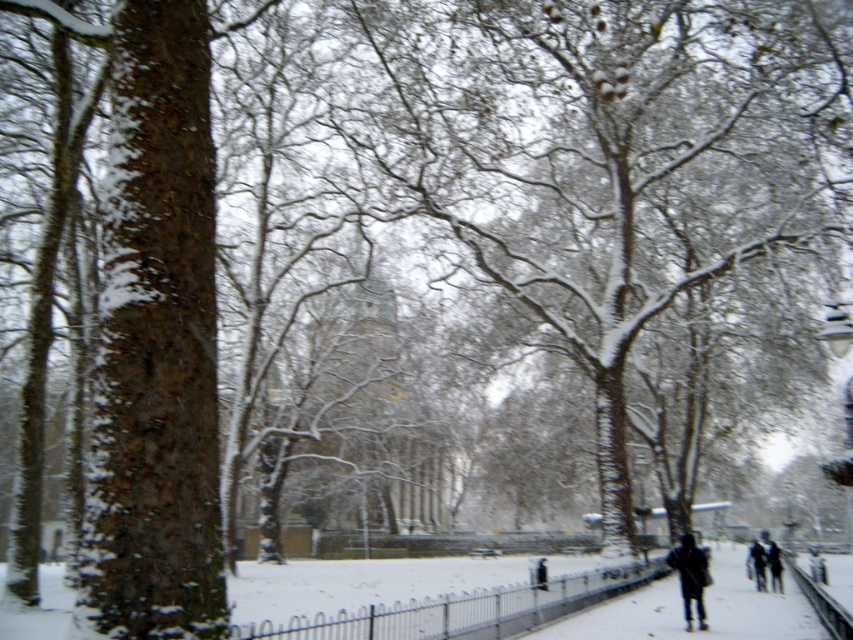
The width and height of the screenshot is (853, 640). Describe the element at coordinates (689, 577) in the screenshot. I see `dark blue jacket at lower right` at that location.

Is point (701, 556) positioned in front of point (753, 541)?

Yes, it is in front of point (753, 541).

Identify the location of dark blue jacket at lower right. The height and width of the screenshot is (640, 853). (689, 577).

In the scene shown: Who is shorter, white snow at center or dark blue jacket at lower right?

dark blue jacket at lower right

Does white snow at center appear on the right side of dark blue jacket at lower right?

Indeed, white snow at center is positioned on the right side of dark blue jacket at lower right.

Which is in front, point (728, 627) or point (695, 579)?

Point (728, 627) is more forward.

Find the location of a particular element. Image resolution: width=853 pixels, height=640 pixels. white snow at center is located at coordinates (705, 609).

Can you confirm if white snow at center is positioned to the left of dark gray jacket at lower right?

Yes, white snow at center is to the left of dark gray jacket at lower right.

Measure the distance between white snow at center and camera.

white snow at center and camera are 13.50 meters apart from each other.

Which is behind, point (784, 627) or point (761, 582)?

Positioned behind is point (761, 582).

Where is `white snow at center`? white snow at center is located at coordinates (705, 609).